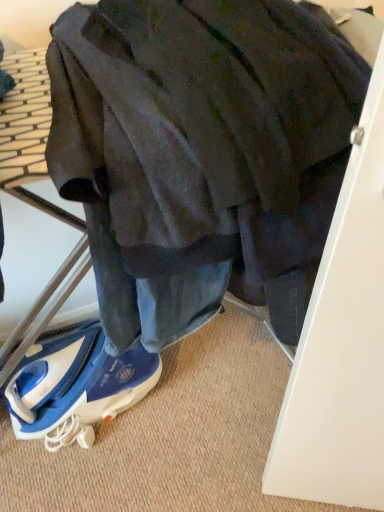
What is the approximate width of blue fabric shoe at lower center?

blue fabric shoe at lower center is 8.94 inches in width.

Describe the element at coordinates (76, 387) in the screenshot. I see `blue fabric shoe at lower center` at that location.

Where is `blue fabric shoe at lower center`? blue fabric shoe at lower center is located at coordinates (76, 387).

Locate an element on the screen. dark corduroy jacket at center is located at coordinates (201, 153).

The height and width of the screenshot is (512, 384). Describe the element at coordinates (201, 153) in the screenshot. I see `dark corduroy jacket at center` at that location.

You are a GUI agent. You are given a task and a screenshot of the screen. Output one action in this format:
    pyautogui.click(x=<x>, y=<y>)
    Task: Click on the blue fabric shoe at lower center
    
    Given the screenshot: What is the action you would take?
    pyautogui.click(x=76, y=387)

Which object is positioned more to the left, dark corduroy jacket at center or blue fabric shoe at lower center?

blue fabric shoe at lower center is more to the left.

Considering the relative positions of dark corduroy jacket at center and blue fabric shoe at lower center in the image provided, is dark corduroy jacket at center behind blue fabric shoe at lower center?

No, dark corduroy jacket at center is closer to the viewer.

Is point (239, 185) positioned in front of point (19, 366)?

Yes, it is.

From the image's perspective, would you say dark corduroy jacket at center is positioned over blue fabric shoe at lower center?

Yes, from the image's perspective, dark corduroy jacket at center is over blue fabric shoe at lower center.

From a real-world perspective, which object rests below the other?

blue fabric shoe at lower center is physically lower.

Considering the relative sizes of dark corduroy jacket at center and blue fabric shoe at lower center in the image provided, is dark corduroy jacket at center thinner than blue fabric shoe at lower center?

No, dark corduroy jacket at center is not thinner than blue fabric shoe at lower center.

Considering the sizes of objects dark corduroy jacket at center and blue fabric shoe at lower center in the image provided, who is shorter, dark corduroy jacket at center or blue fabric shoe at lower center?

Standing shorter between the two is blue fabric shoe at lower center.

Considering the sizes of dark corduroy jacket at center and blue fabric shoe at lower center in the image, is dark corduroy jacket at center bigger or smaller than blue fabric shoe at lower center?

In the image, dark corduroy jacket at center appears to be larger than blue fabric shoe at lower center.

Can blue fabric shoe at lower center be found inside dark corduroy jacket at center?

No, blue fabric shoe at lower center is not inside dark corduroy jacket at center.

Is dark corduroy jacket at center next to blue fabric shoe at lower center?

No, dark corduroy jacket at center is not in contact with blue fabric shoe at lower center.

Is dark corduroy jacket at center looking in the opposite direction of blue fabric shoe at lower center?

dark corduroy jacket at center is not turned away from blue fabric shoe at lower center.

How many degrees apart are the facing directions of dark corduroy jacket at center and blue fabric shoe at lower center?

There is a 0.513-degree angle between the facing directions of dark corduroy jacket at center and blue fabric shoe at lower center.

In the image, there is a blue fabric shoe at lower center. At what (x,y) coordinates should I click in order to perform the action: click on jacket above it (from the image's perspective). Please return your answer as a coordinate pair (x, y). This screenshot has height=512, width=384. Looking at the image, I should click on (201, 153).

Considering the relative positions of blue fabric shoe at lower center and dark corduroy jacket at center in the image provided, is blue fabric shoe at lower center to the left or to the right of dark corduroy jacket at center?

From the image, it's evident that blue fabric shoe at lower center is to the left of dark corduroy jacket at center.

Between blue fabric shoe at lower center and dark corduroy jacket at center, which one is positioned behind?

blue fabric shoe at lower center is behind.

Between point (11, 389) and point (143, 303), which one is positioned in front?

The point (143, 303) is in front.

From the image's perspective, which one is positioned lower, blue fabric shoe at lower center or dark corduroy jacket at center?

blue fabric shoe at lower center.

From a real-world perspective, between blue fabric shoe at lower center and dark corduroy jacket at center, who is vertically lower?

blue fabric shoe at lower center is physically lower.

In terms of width, does blue fabric shoe at lower center look wider or thinner when compared to dark corduroy jacket at center?

In the image, blue fabric shoe at lower center appears to be more narrow than dark corduroy jacket at center.

Which of these two, blue fabric shoe at lower center or dark corduroy jacket at center, stands taller?

dark corduroy jacket at center.

In terms of size, does blue fabric shoe at lower center appear bigger or smaller than dark corduroy jacket at center?

Considering their sizes, blue fabric shoe at lower center takes up less space than dark corduroy jacket at center.

Is blue fabric shoe at lower center not within dark corduroy jacket at center?

That's correct, blue fabric shoe at lower center is outside of dark corduroy jacket at center.

Is blue fabric shoe at lower center touching dark corduroy jacket at center?

No, blue fabric shoe at lower center is not making contact with dark corduroy jacket at center.

Is blue fabric shoe at lower center turned away from dark corduroy jacket at center?

No, dark corduroy jacket at center is not at the back of blue fabric shoe at lower center.

How many degrees apart are the facing directions of blue fabric shoe at lower center and dark corduroy jacket at center?

The angular difference between blue fabric shoe at lower center and dark corduroy jacket at center is 0.513 degrees.

How far apart are blue fabric shoe at lower center and dark corduroy jacket at center?

blue fabric shoe at lower center and dark corduroy jacket at center are 53.92 centimeters apart from each other.

Find the location of a particular element. The image size is (384, 512). footwear below the dark corduroy jacket at center (from the image's perspective) is located at coordinates (76, 387).

The image size is (384, 512). I want to click on jacket on the right of blue fabric shoe at lower center, so click(x=201, y=153).

Where is `footwear below the dark corduroy jacket at center (from the image's perspective)`? This screenshot has width=384, height=512. footwear below the dark corduroy jacket at center (from the image's perspective) is located at coordinates (76, 387).